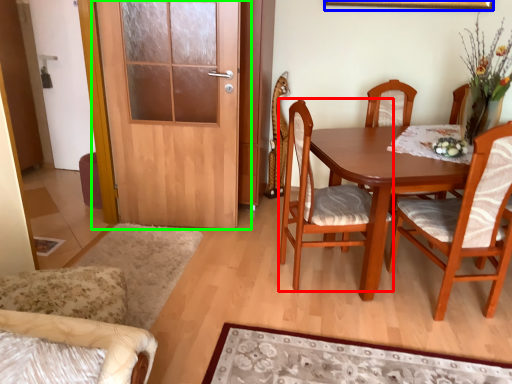
Question: Which is farther away from chair (highlighted by a red box)? picture frame (highlighted by a blue box) or door (highlighted by a green box)?

Choices:
 (A) picture frame
 (B) door

Answer: (A)